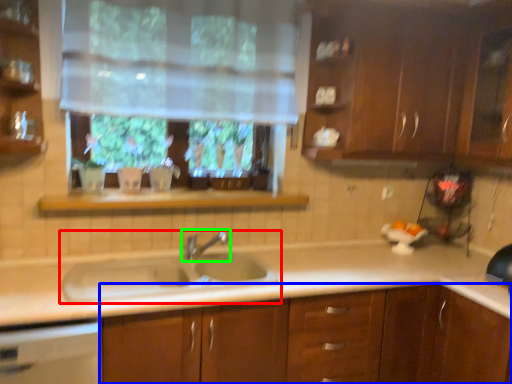
Question: Based on their relative distances, which object is farther from sink (highlighted by a red box)? Choose from cabinetry (highlighted by a blue box) and tap (highlighted by a green box).

Choices:
 (A) cabinetry
 (B) tap

Answer: (A)